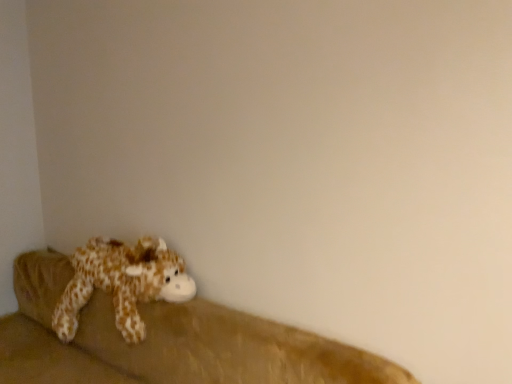
What do you see at coordinates (122, 283) in the screenshot? I see `fluffy brown plush giraffe at lower left` at bounding box center [122, 283].

The height and width of the screenshot is (384, 512). I want to click on fluffy brown plush giraffe at lower left, so click(122, 283).

What do you see at coordinates (167, 342) in the screenshot? The height and width of the screenshot is (384, 512). I see `brown plush couch at lower left` at bounding box center [167, 342].

This screenshot has height=384, width=512. In order to click on brown plush couch at lower left in this screenshot , I will do pos(167,342).

The width and height of the screenshot is (512, 384). Identify the location of fluffy brown plush giraffe at lower left. (122, 283).

Consider the image. Is fluffy brown plush giraffe at lower left to the right of brown plush couch at lower left from the viewer's perspective?

No, fluffy brown plush giraffe at lower left is not to the right of brown plush couch at lower left.

Does fluffy brown plush giraffe at lower left lie in front of brown plush couch at lower left?

No, fluffy brown plush giraffe at lower left is further to the viewer.

Which is nearer, (86,249) or (90,353)?

The point (90,353) is closer to the camera.

From the image's perspective, is fluffy brown plush giraffe at lower left beneath brown plush couch at lower left?

No, from the image's perspective, fluffy brown plush giraffe at lower left is not beneath brown plush couch at lower left.

From a real-world perspective, which is physically below, fluffy brown plush giraffe at lower left or brown plush couch at lower left?

From a 3D spatial view, brown plush couch at lower left is below.

Which object is wider, fluffy brown plush giraffe at lower left or brown plush couch at lower left?

brown plush couch at lower left is wider.

Which of these two, fluffy brown plush giraffe at lower left or brown plush couch at lower left, stands shorter?

With less height is fluffy brown plush giraffe at lower left.

Can you confirm if fluffy brown plush giraffe at lower left is smaller than brown plush couch at lower left?

Indeed, fluffy brown plush giraffe at lower left has a smaller size compared to brown plush couch at lower left.

Could brown plush couch at lower left be considered to be inside fluffy brown plush giraffe at lower left?

No, brown plush couch at lower left is located outside of fluffy brown plush giraffe at lower left.

Is fluffy brown plush giraffe at lower left next to brown plush couch at lower left and touching it?

No, fluffy brown plush giraffe at lower left is not beside brown plush couch at lower left.

Is fluffy brown plush giraffe at lower left facing away from brown plush couch at lower left?

Yes, fluffy brown plush giraffe at lower left's orientation is away from brown plush couch at lower left.

Based on the photo, what's the angular difference between fluffy brown plush giraffe at lower left and brown plush couch at lower left's facing directions?

The angular difference between fluffy brown plush giraffe at lower left and brown plush couch at lower left is 1.03 degrees.

This screenshot has height=384, width=512. I want to click on toy located above the brown plush couch at lower left (from the image's perspective), so click(122, 283).

Can you confirm if brown plush couch at lower left is positioned to the right of fluffy brown plush giraffe at lower left?

Yes, brown plush couch at lower left is to the right of fluffy brown plush giraffe at lower left.

Considering their positions, is brown plush couch at lower left located in front of or behind fluffy brown plush giraffe at lower left?

Visually, brown plush couch at lower left is located in front of fluffy brown plush giraffe at lower left.

Between point (265, 321) and point (132, 305), which one is positioned in front?

Point (265, 321)

From the image's perspective, which one is positioned higher, brown plush couch at lower left or fluffy brown plush giraffe at lower left?

fluffy brown plush giraffe at lower left is shown above in the image.

From a real-world perspective, between brown plush couch at lower left and fluffy brown plush giraffe at lower left, who is vertically higher?

fluffy brown plush giraffe at lower left is physically above.

Can you confirm if brown plush couch at lower left is thinner than fluffy brown plush giraffe at lower left?

No, brown plush couch at lower left is not thinner than fluffy brown plush giraffe at lower left.

Can you confirm if brown plush couch at lower left is shorter than fluffy brown plush giraffe at lower left?

No, brown plush couch at lower left is not shorter than fluffy brown plush giraffe at lower left.

In the scene shown: Between brown plush couch at lower left and fluffy brown plush giraffe at lower left, which one has larger size?

brown plush couch at lower left.

Which is correct: brown plush couch at lower left is inside fluffy brown plush giraffe at lower left, or outside of it?

brown plush couch at lower left cannot be found inside fluffy brown plush giraffe at lower left.

Is brown plush couch at lower left far from fluffy brown plush giraffe at lower left?

No, there isn't a large distance between brown plush couch at lower left and fluffy brown plush giraffe at lower left.

Could you tell me if brown plush couch at lower left is facing fluffy brown plush giraffe at lower left?

No, brown plush couch at lower left is not turned towards fluffy brown plush giraffe at lower left.

How many degrees apart are the facing directions of brown plush couch at lower left and fluffy brown plush giraffe at lower left?

The angular difference between brown plush couch at lower left and fluffy brown plush giraffe at lower left is 1.03 degrees.

Where is `studio couch on the right of the fluffy brown plush giraffe at lower left`? studio couch on the right of the fluffy brown plush giraffe at lower left is located at coordinates (167, 342).

You are a GUI agent. You are given a task and a screenshot of the screen. Output one action in this format:
    pyautogui.click(x=<x>, y=<y>)
    Task: Click on the toy that is above the brown plush couch at lower left (from a real-world perspective)
    
    Given the screenshot: What is the action you would take?
    pyautogui.click(x=122, y=283)

This screenshot has width=512, height=384. Identify the location of studio couch below the fluffy brown plush giraffe at lower left (from a real-world perspective). (167, 342).